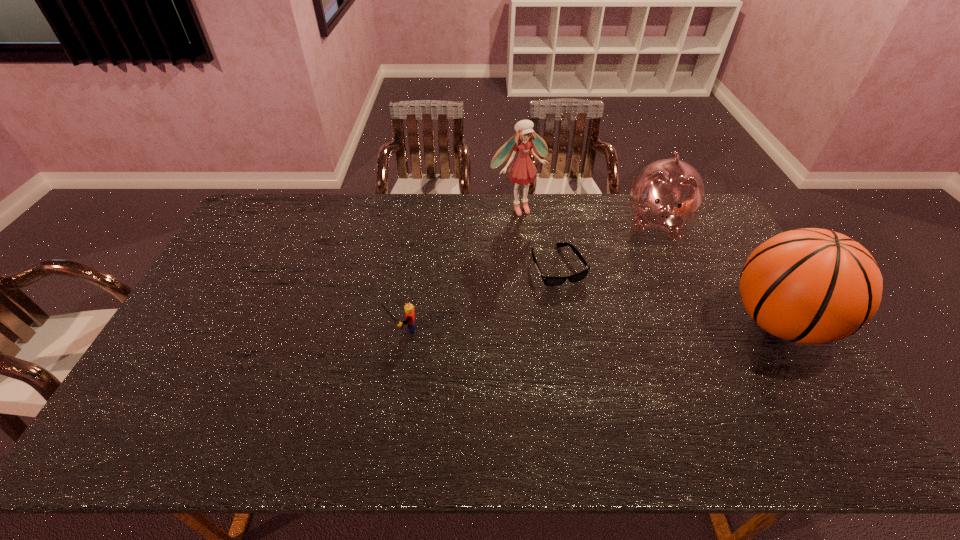
The height and width of the screenshot is (540, 960). Find the location of `object identified as the second closest to the shortest object`. object identified as the second closest to the shortest object is located at coordinates (668, 194).

Image resolution: width=960 pixels, height=540 pixels. Find the location of `object that stands as the fourth closest to the sunglasses`. object that stands as the fourth closest to the sunglasses is located at coordinates (409, 309).